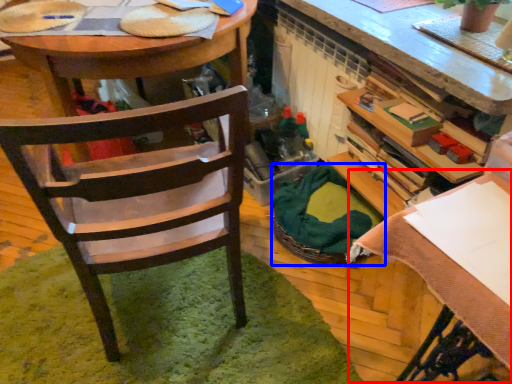
Question: Which object appears closest to the camera in this image, table (highlighted by a red box) or picnic basket (highlighted by a blue box)?

Choices:
 (A) table
 (B) picnic basket

Answer: (A)